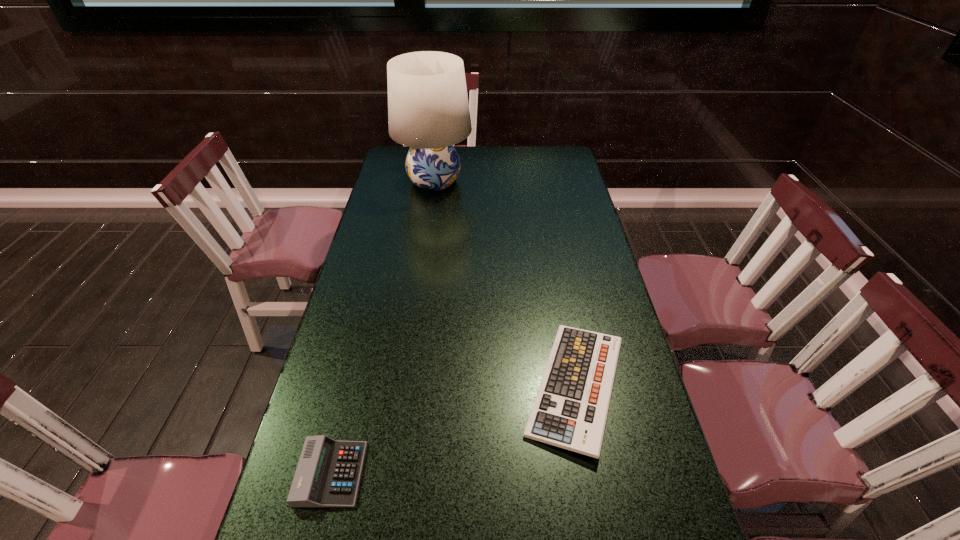
At what (x,y) coordinates should I click in order to perform the action: click on object that is the second closest to the farthest object. Please return your answer as a coordinate pair (x, y). This screenshot has width=960, height=540. Looking at the image, I should click on pos(328,473).

Find the location of a particular element. The image size is (960, 540). vacant space that satisfies the following two spatial constraints: 1. on the front-facing side of the shortest object; 2. on the left side of the farthest object is located at coordinates (405, 387).

You are a GUI agent. You are given a task and a screenshot of the screen. Output one action in this format:
    pyautogui.click(x=<x>, y=<y>)
    Task: Click on the free space that satisfies the following two spatial constraints: 1. on the front-facing side of the computer keyboard; 2. on the right side of the farthest object
    
    Given the screenshot: What is the action you would take?
    pyautogui.click(x=405, y=387)

The height and width of the screenshot is (540, 960). I want to click on vacant space that satisfies the following two spatial constraints: 1. on the back side of the shortest object; 2. on the front-facing side of the farthest object, so click(x=538, y=181).

Identify the location of free space that satisfies the following two spatial constraints: 1. on the front-facing side of the shortest object; 2. on the right side of the farthest object. The image size is (960, 540). (405, 387).